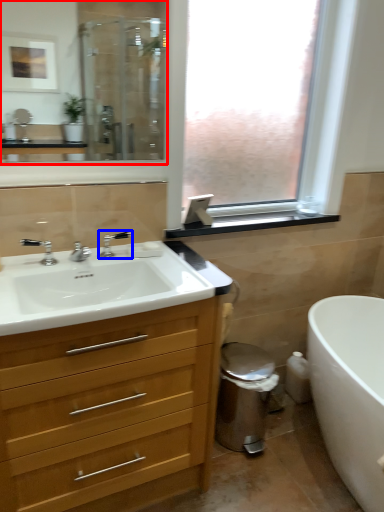
Question: Which object is closer to the camera taking this photo, mirror (highlighted by a red box) or tap (highlighted by a blue box)?

Choices:
 (A) mirror
 (B) tap

Answer: (A)